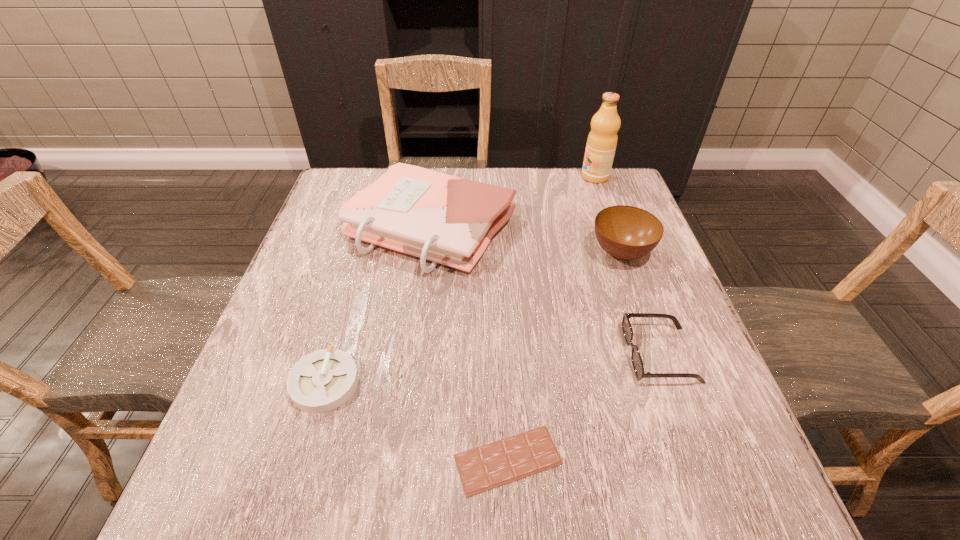
At what (x,y) coordinates should I click in order to perform the action: click on the farthest object. Please return your answer as a coordinate pair (x, y). The width and height of the screenshot is (960, 540). Looking at the image, I should click on (602, 140).

This screenshot has width=960, height=540. In order to click on fruit juice in this screenshot , I will do `click(602, 140)`.

Find the location of a particular element. The width and height of the screenshot is (960, 540). phonebook is located at coordinates (445, 219).

Where is `bowl`? The width and height of the screenshot is (960, 540). bowl is located at coordinates (625, 232).

Where is `the third shortest object`? Image resolution: width=960 pixels, height=540 pixels. the third shortest object is located at coordinates (636, 359).

You are a GUI agent. You are given a task and a screenshot of the screen. Output one action in this format:
    pyautogui.click(x=<x>, y=<y>)
    Task: Click on the ashtray
    The width and height of the screenshot is (960, 540).
    Given the screenshot: What is the action you would take?
    pyautogui.click(x=323, y=380)

Find the location of a particular element. The width and height of the screenshot is (960, 540). the nearest object is located at coordinates (495, 464).

Find the location of a particular element. The height and width of the screenshot is (540, 960). chocolate bar is located at coordinates (495, 464).

In order to click on vacant space located 0.130m on the front label of the tallest object in this screenshot , I will do coord(538,177).

Identify the location of free space located 0.220m on the front label of the tallest object. (508, 177).